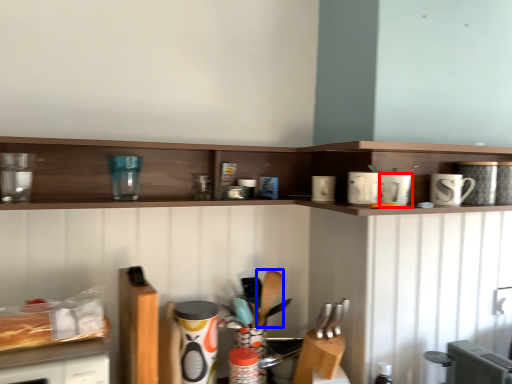
Question: Which object appears closest to the camera in this image, appliance (highlighted by a red box) or silverware (highlighted by a blue box)?

Choices:
 (A) appliance
 (B) silverware

Answer: (A)